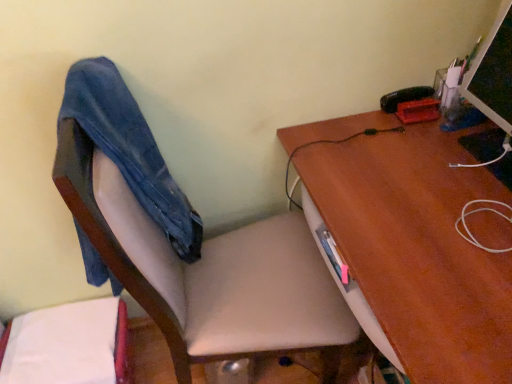
Question: Is denim at left a part of smooth beige chair at center?

Choices:
 (A) yes
 (B) no

Answer: (A)

Question: Is smooth beige chair at center looking in the opposite direction of denim at left?

Choices:
 (A) no
 (B) yes

Answer: (B)

Question: Considering the relative positions of smooth beige chair at center and denim at left in the image provided, is smooth beige chair at center to the left of denim at left from the viewer's perspective?

Choices:
 (A) yes
 (B) no

Answer: (B)

Question: Is smooth beige chair at center not near denim at left?

Choices:
 (A) yes
 (B) no

Answer: (B)

Question: Is smooth beige chair at center positioned behind denim at left?

Choices:
 (A) no
 (B) yes

Answer: (A)

Question: Considering the relative sizes of smooth beige chair at center and denim at left in the image provided, is smooth beige chair at center smaller than denim at left?

Choices:
 (A) yes
 (B) no

Answer: (B)

Question: From the image's perspective, is brown wood desk at upper right on smooth beige chair at center?

Choices:
 (A) yes
 (B) no

Answer: (B)

Question: Is brown wood desk at upper right at the right side of smooth beige chair at center?

Choices:
 (A) no
 (B) yes

Answer: (B)

Question: From a real-world perspective, is brown wood desk at upper right located beneath smooth beige chair at center?

Choices:
 (A) no
 (B) yes

Answer: (B)

Question: From the image's perspective, does brown wood desk at upper right appear lower than smooth beige chair at center?

Choices:
 (A) no
 (B) yes

Answer: (B)

Question: Would you say smooth beige chair at center is part of brown wood desk at upper right's contents?

Choices:
 (A) yes
 (B) no

Answer: (B)

Question: Does brown wood desk at upper right lie behind smooth beige chair at center?

Choices:
 (A) no
 (B) yes

Answer: (B)

Question: From the image's perspective, does matte black monitor at upper right appear lower than denim at left?

Choices:
 (A) no
 (B) yes

Answer: (A)